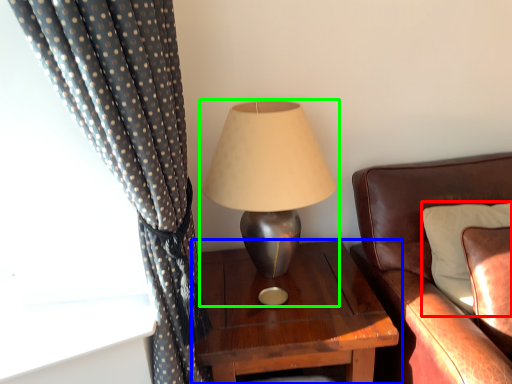
Question: Based on their relative distances, which object is farther from pillow (highlighted by a red box)? Choose from nightstand (highlighted by a blue box) and lamp (highlighted by a green box).

Choices:
 (A) nightstand
 (B) lamp

Answer: (B)